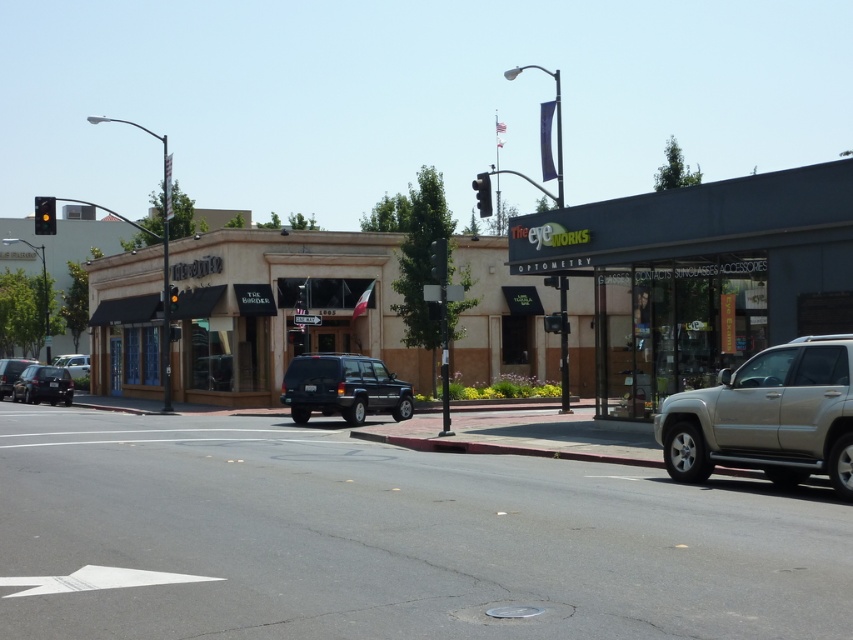
Which is more to the right, matte black sign at center or matte black car at lower left?

matte black sign at center

Measure the distance between matte black sign at center and camera.

They are 17.96 meters apart.

Which is behind, point (831, 214) or point (39, 374)?

The point (39, 374) is more distant.

You are a GUI agent. You are given a task and a screenshot of the screen. Output one action in this format:
    pyautogui.click(x=<x>, y=<y>)
    Task: Click on the matte black sign at center
    This screenshot has width=853, height=640.
    Given the screenshot: What is the action you would take?
    pyautogui.click(x=699, y=275)

Between black asphalt road at center and matte black suv at center, which one has more height?

matte black suv at center is taller.

Can you confirm if black asphalt road at center is positioned below matte black suv at center?

Yes.

This screenshot has height=640, width=853. What are the coordinates of `black asphalt road at center` in the screenshot? It's located at (387, 538).

Who is more forward, (549, 513) or (83, 356)?

Point (549, 513)

Can you confirm if black asphalt road at center is thinner than metallic silver car at left?

No, black asphalt road at center is not thinner than metallic silver car at left.

Image resolution: width=853 pixels, height=640 pixels. Describe the element at coordinates (387, 538) in the screenshot. I see `black asphalt road at center` at that location.

Where is `black asphalt road at center`? black asphalt road at center is located at coordinates (387, 538).